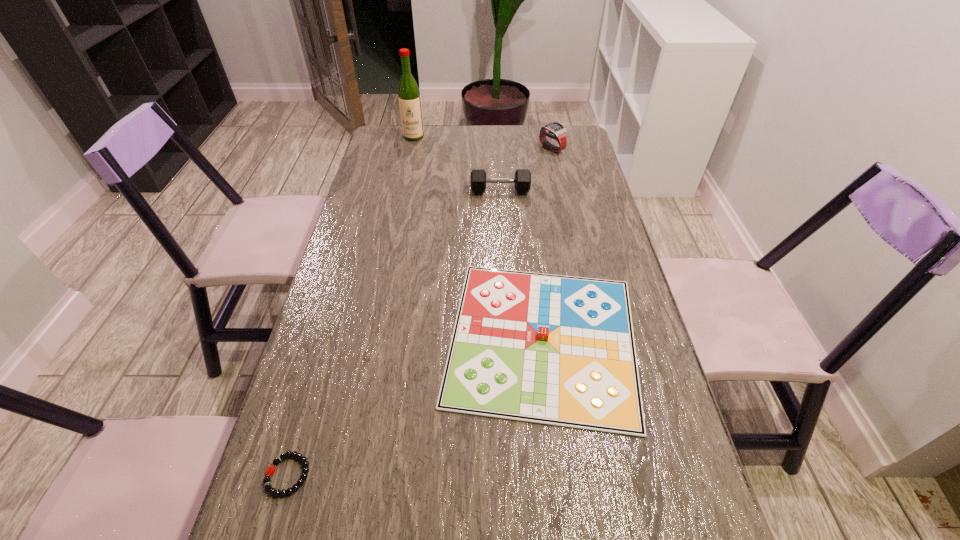
Image resolution: width=960 pixels, height=540 pixels. I want to click on the tallest object, so click(x=409, y=97).

Locate an element on the screen. the fourth object from right to left is located at coordinates (409, 97).

Where is `watch`? watch is located at coordinates (556, 130).

Locate an element on the screen. dumbbell is located at coordinates (522, 181).

I want to click on the fourth farthest object, so click(559, 350).

Where is `the fourth tallest object`? The image size is (960, 540). the fourth tallest object is located at coordinates (559, 350).

The height and width of the screenshot is (540, 960). What are the coordinates of `the nearest object` in the screenshot? It's located at (271, 469).

Where is `the shortest object`? the shortest object is located at coordinates (271, 469).

Locate an element on the screen. This screenshot has height=540, width=960. free point located 0.350m on the label of the second object from left to right is located at coordinates (401, 196).

This screenshot has width=960, height=540. Identify the location of blank space located 0.200m on the front of the watch. (561, 188).